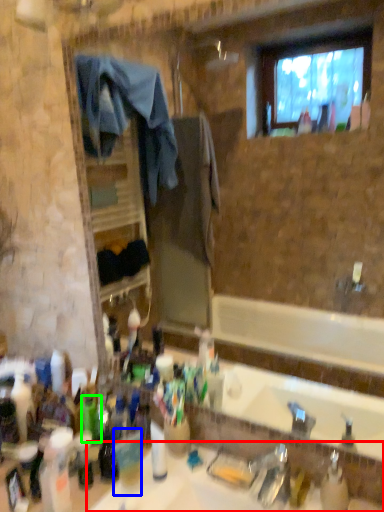
Question: Which object is positioned farthest from sink (highlighted by a red box)? Select from coffee cup (highlighted by a blue box) and bottle (highlighted by a green box).

Choices:
 (A) coffee cup
 (B) bottle

Answer: (B)